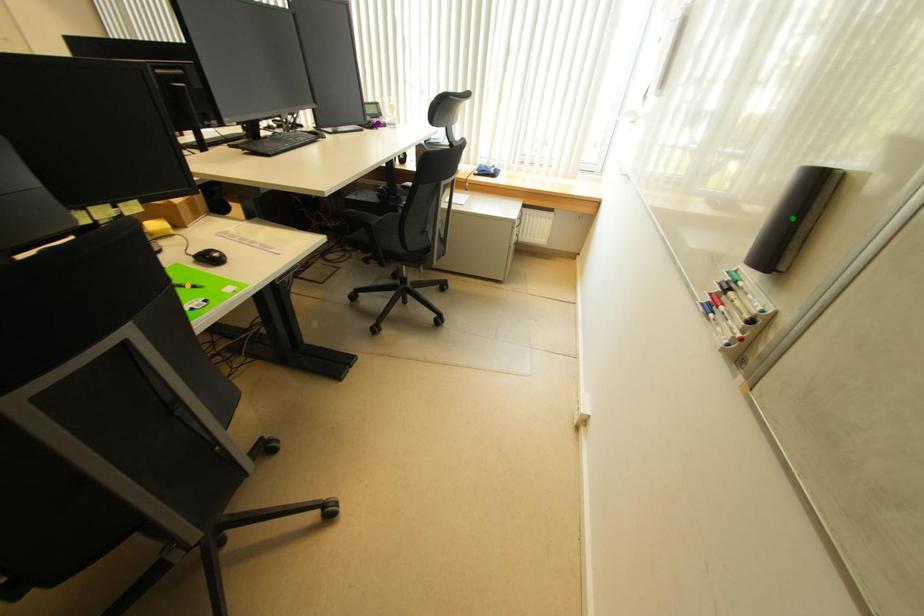
Order these from nearest to farthest:
1. orange point
2. purple point
3. green point

green point, orange point, purple point